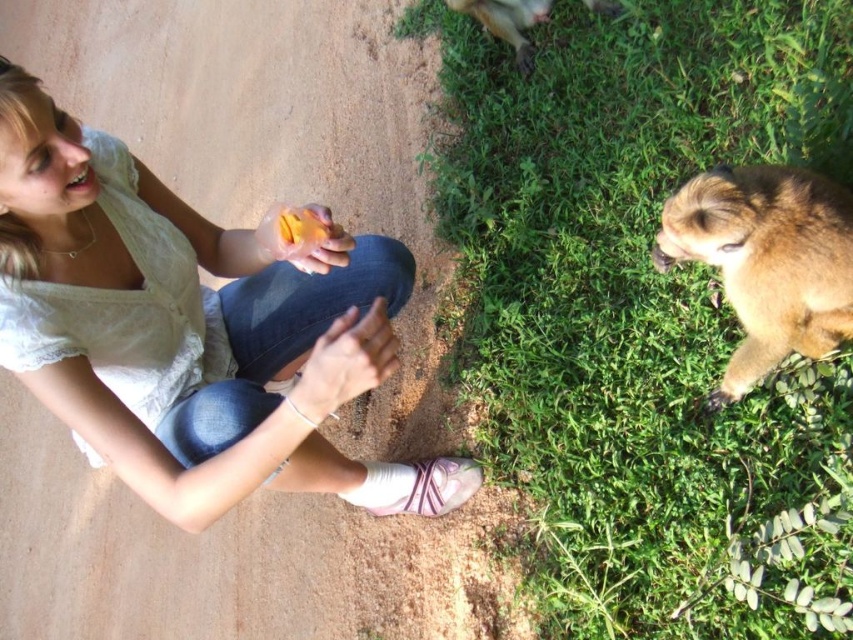
Question: Which point is closer to the camera?

Choices:
 (A) brown furry monkey at upper right
 (B) white lace shirt at upper left

Answer: (B)

Question: Is green grass at lower right to the right of brown furry monkey at upper right from the viewer's perspective?

Choices:
 (A) yes
 (B) no

Answer: (A)

Question: Does white lace shirt at upper left have a greater width compared to brown furry dog at lower right?

Choices:
 (A) no
 (B) yes

Answer: (B)

Question: Which point is farther to the camera?

Choices:
 (A) (735, 234)
 (B) (845, 472)
 (C) (161, 500)
 (D) (532, 20)

Answer: (D)

Question: Based on their relative distances, which object is nearer to the white lace shirt at upper left?

Choices:
 (A) brown furry monkey at upper right
 (B) brown furry dog at lower right

Answer: (B)

Question: Considering the relative positions of brown furry dog at lower right and brown furry monkey at upper right in the image provided, where is brown furry dog at lower right located with respect to brown furry monkey at upper right?

Choices:
 (A) right
 (B) left

Answer: (A)